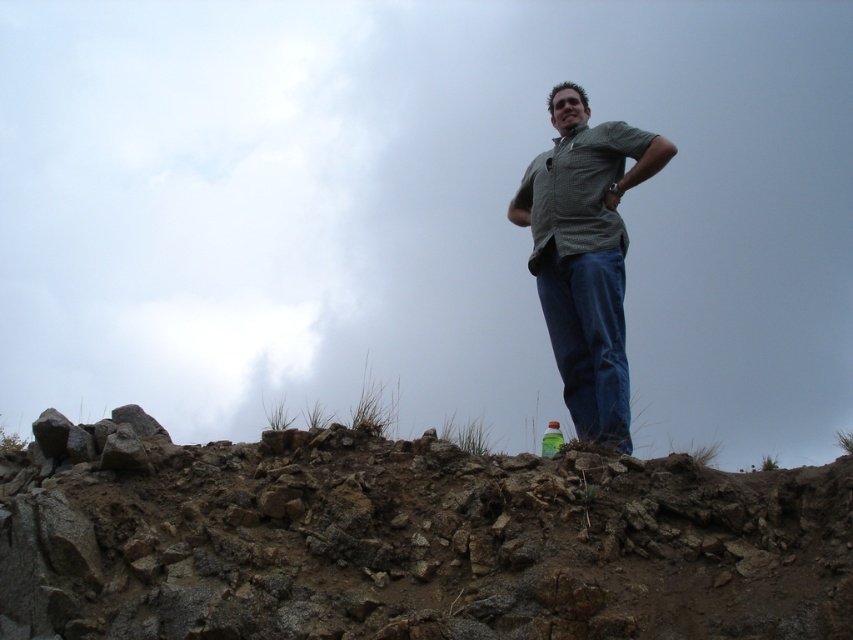
Can you confirm if rough stone hillside at center is shorter than blue denim jeans at center?

Yes, rough stone hillside at center is shorter than blue denim jeans at center.

Who is more forward, [169,461] or [579,358]?

Positioned in front is point [169,461].

I want to click on rough stone hillside at center, so click(407, 540).

Can you confirm if checkered fabric shirt at center is shorter than green plastic bottle at center?

Correct, checkered fabric shirt at center is not as tall as green plastic bottle at center.

Does checkered fabric shirt at center appear over green plastic bottle at center?

Yes, checkered fabric shirt at center is above green plastic bottle at center.

Who is more distant from viewer, (619, 305) or (550, 440)?

Point (550, 440)

Where is `checkered fabric shirt at center`? The image size is (853, 640). checkered fabric shirt at center is located at coordinates (585, 253).

From the picture: Can you confirm if rough stone hillside at center is positioned below green plastic bottle at center?

Correct, rough stone hillside at center is located below green plastic bottle at center.

This screenshot has height=640, width=853. I want to click on rough stone hillside at center, so click(x=407, y=540).

Does point (341, 461) come farther from viewer compared to point (550, 451)?

No, it is not.

Find the location of a particular element. Image resolution: width=853 pixels, height=640 pixels. rough stone hillside at center is located at coordinates (407, 540).